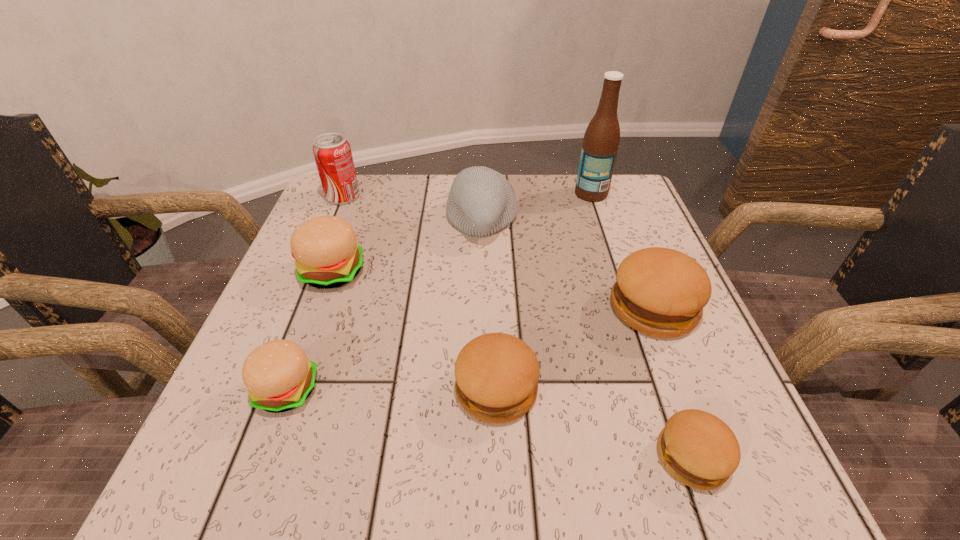
At what (x,y) coordinates should I click in order to perform the action: click on blank region between the second biggest brown hamburger and the shortest hamburger. Please return your answer as a coordinate pair (x, y). Looking at the image, I should click on (594, 423).

At what (x,y) coordinates should I click in order to perform the action: click on object that stands as the fourth closest to the farthest brown hamburger. Please return your answer as a coordinate pair (x, y). The height and width of the screenshot is (540, 960). Looking at the image, I should click on (601, 140).

Identify the location of the closest object to the nearer beige hamburger. The width and height of the screenshot is (960, 540). (327, 255).

You are a GUI agent. You are given a task and a screenshot of the screen. Output one action in this format:
    pyautogui.click(x=<x>, y=<y>)
    Task: Click on the hamburger object that ranks as the closest to the shortest object
    The height and width of the screenshot is (540, 960).
    Given the screenshot: What is the action you would take?
    click(x=497, y=374)

Choose which hamburger is the second nearest neighbor to the farther beige hamburger. Please provide its 2D coordinates. Your answer should be formatted as a tuple, i.e. [(x, y)], where the tuple contains the x and y coordinates of a point satisfying the conditions above.

[(497, 374)]

Image resolution: width=960 pixels, height=540 pixels. I want to click on the closest brown hamburger to the farther beige hamburger, so click(x=497, y=374).

Select which brown hamburger is the second closest to the tallest object. Please provide its 2D coordinates. Your answer should be formatted as a tuple, i.e. [(x, y)], where the tuple contains the x and y coordinates of a point satisfying the conditions above.

[(497, 374)]

The image size is (960, 540). What are the coordinates of `free space that satisfies the following two spatial constraints: 1. on the back side of the beer bottle; 2. on the left side of the gray beanie` in the screenshot? It's located at (x=482, y=193).

Identify the location of free location that satisfies the following two spatial constraints: 1. on the back side of the nearer beige hamburger; 2. on the right side of the beanie. (349, 220).

In order to click on vacant space that satisfies the following two spatial constraints: 1. on the back side of the beer bottle; 2. on the right side of the second biggest brown hamburger in this screenshot , I will do `click(491, 193)`.